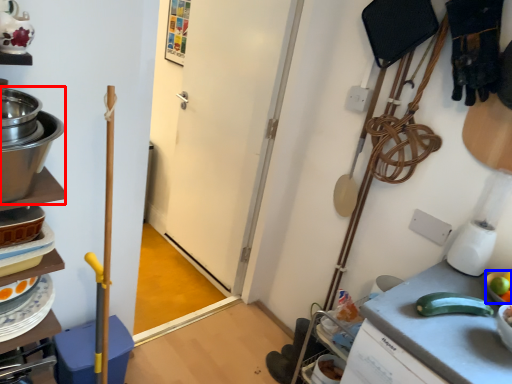
Question: Which object is further to the camera taking this photo, appliance (highlighted by a red box) or fruit (highlighted by a blue box)?

Choices:
 (A) appliance
 (B) fruit

Answer: (B)